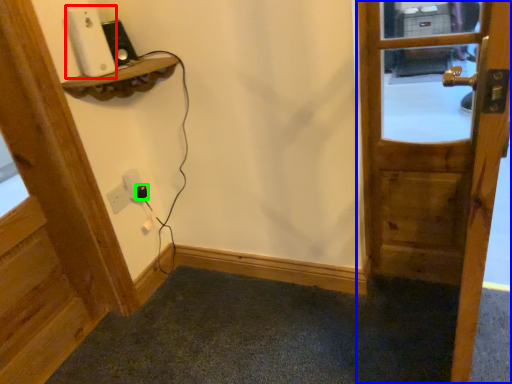
Question: Based on their relative distances, which object is nearer to ipod (highlighted by a red box)? Choose from door (highlighted by a blue box) and plug (highlighted by a green box).

Choices:
 (A) door
 (B) plug

Answer: (B)